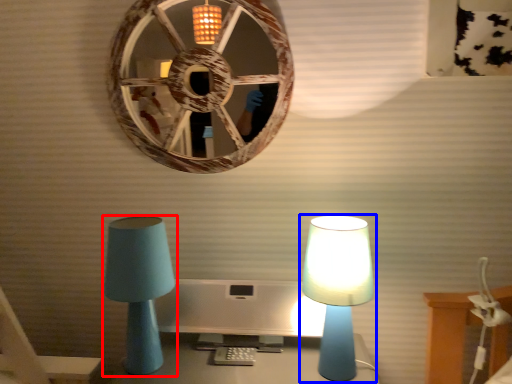
Question: Among these objects, which one is farthest to the camera, lamp (highlighted by a red box) or lamp (highlighted by a blue box)?

Choices:
 (A) lamp
 (B) lamp

Answer: (A)